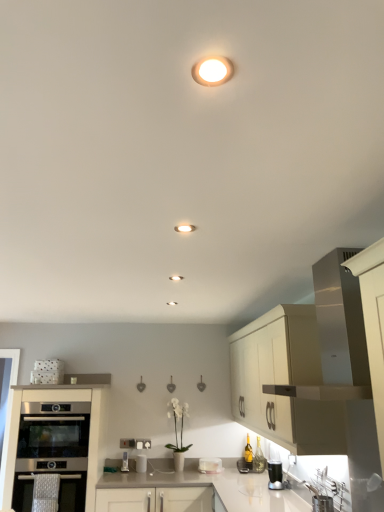
Question: Is matte white light fixture at upper center, marked as the 2th lighting in a left-to-right arrangement, to the left or to the right of matte white recessed light at center, arranged as the 2th lighting when viewed from the front, in the image?

Choices:
 (A) right
 (B) left

Answer: (A)

Question: From the image's perspective, relative to matte white recessed light at center, positioned as the second lighting in right-to-left order, is matte white light fixture at upper center, positioned as the first lighting in top-to-bottom order, above or below?

Choices:
 (A) above
 (B) below

Answer: (A)

Question: Which object is positioned farthest from the white glossy toaster at lower center, which is the second appliance in left-to-right order?

Choices:
 (A) translucent glass bottle at lower right
 (B) white glossy countertop at center
 (C) white matte cabinet at upper right, the 2th cabinetry in the left-to-right sequence
 (D) matte white recessed light at center, the 1th lighting when ordered from back to front
 (E) stainless steel oven at lower left, which is the 2th oven in bottom-to-top order

Answer: (D)

Question: Estimate the real-world distances between objects in this image. Which object is farther from the translucent glass bottle at lower right?

Choices:
 (A) stainless steel oven at lower left, the 1th oven from the top
 (B) metallic silver toaster at lower center, marked as the 1th appliance in a left-to-right arrangement
 (C) white glossy countertop at center
 (D) satin silver oven at lower left, positioned as the second cabinetry in right-to-left order
 (E) white glossy toaster at lower center, which is the second appliance in left-to-right order

Answer: (A)